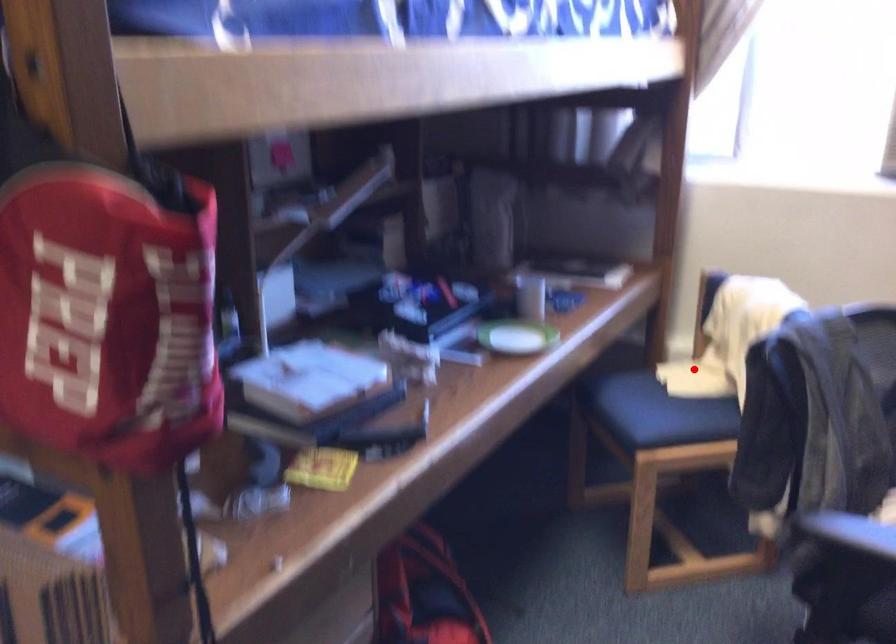
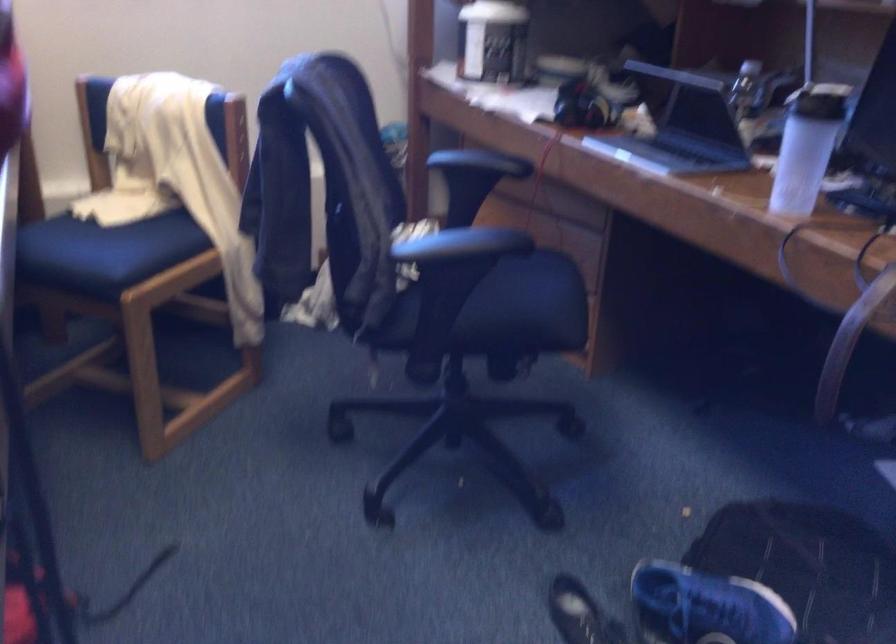
Question: I am providing you with two images of the same scene from different viewpoints. In image1, a red point is highlighted. Considering the same 3D point in image2, which of the following is correct?

Choices:
 (A) It is closer
 (B) It is farther

Answer: (A)